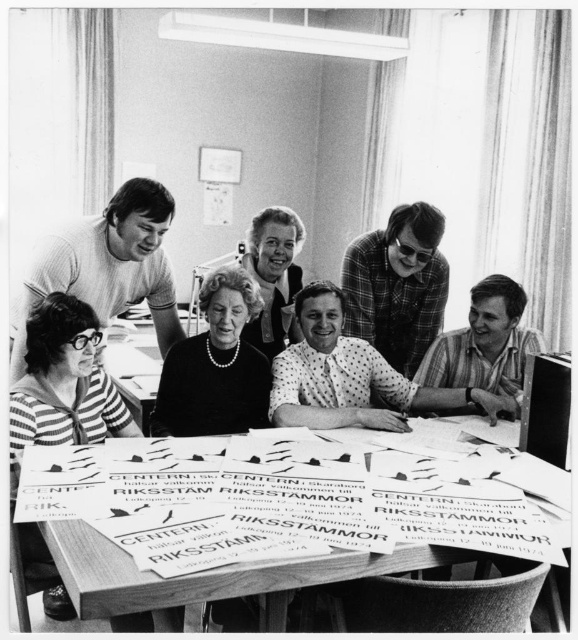
Question: Does polka dot blouse at center appear under matte black dress at center?

Choices:
 (A) yes
 (B) no

Answer: (A)

Question: Can you confirm if striped fabric at lower left is positioned to the right of black pearl necklace at center?

Choices:
 (A) no
 (B) yes

Answer: (A)

Question: Which point is closer to the camera?

Choices:
 (A) click(197, 392)
 (B) click(168, 563)
 (C) click(391, 298)

Answer: (B)

Question: Which point appears closest to the camera in this image?

Choices:
 (A) (431, 396)
 (B) (268, 246)
 (C) (72, 310)

Answer: (C)

Question: Which of the following is the closest to the observer?

Choices:
 (A) (228, 337)
 (B) (253, 259)
 (C) (414, 496)

Answer: (C)

Question: Does wooden table at center appear on the left side of black pearl necklace at center?

Choices:
 (A) no
 (B) yes

Answer: (B)